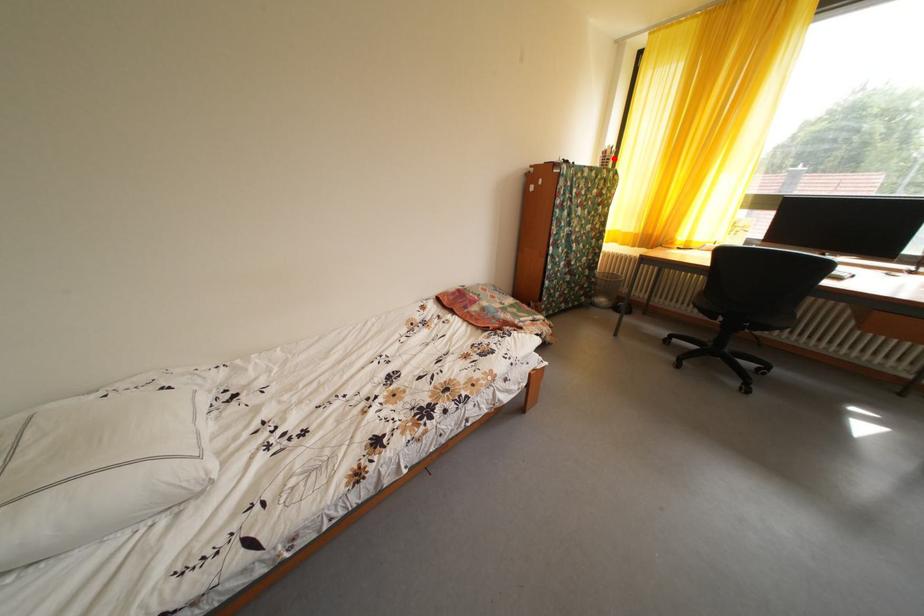
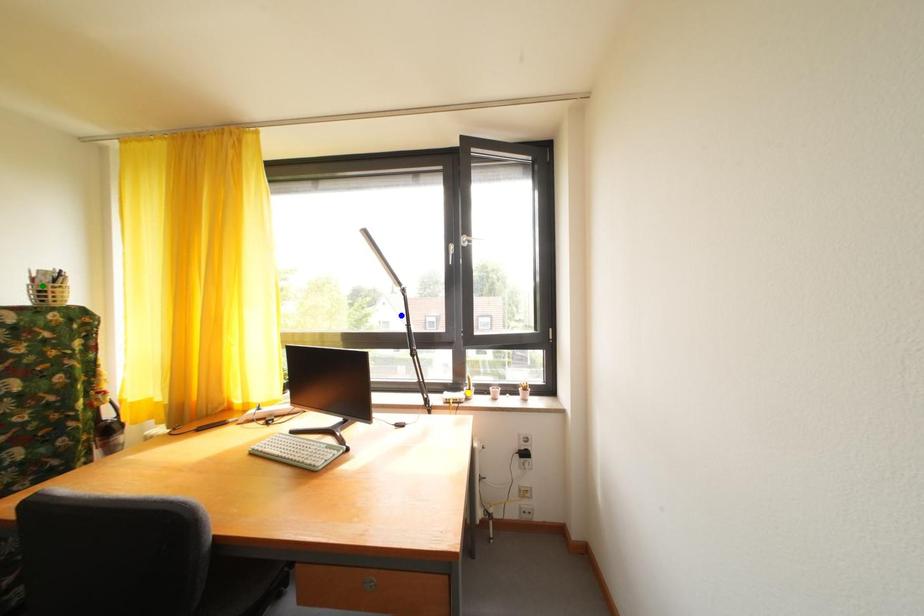
Question: I am providing you with two images of the same scene from different viewpoints. A red point is marked on the first image. You are given multiple points on the second image. Which point in image 2 is actually the same real-world point as the red point in image 1?

Choices:
 (A) yellow point
 (B) green point
 (C) blue point

Answer: (B)